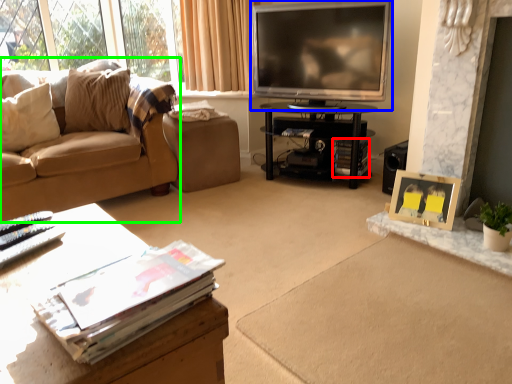
Question: Which is farther away from magazine (highlighted by a red box)? television (highlighted by a blue box) or studio couch (highlighted by a green box)?

Choices:
 (A) television
 (B) studio couch

Answer: (B)